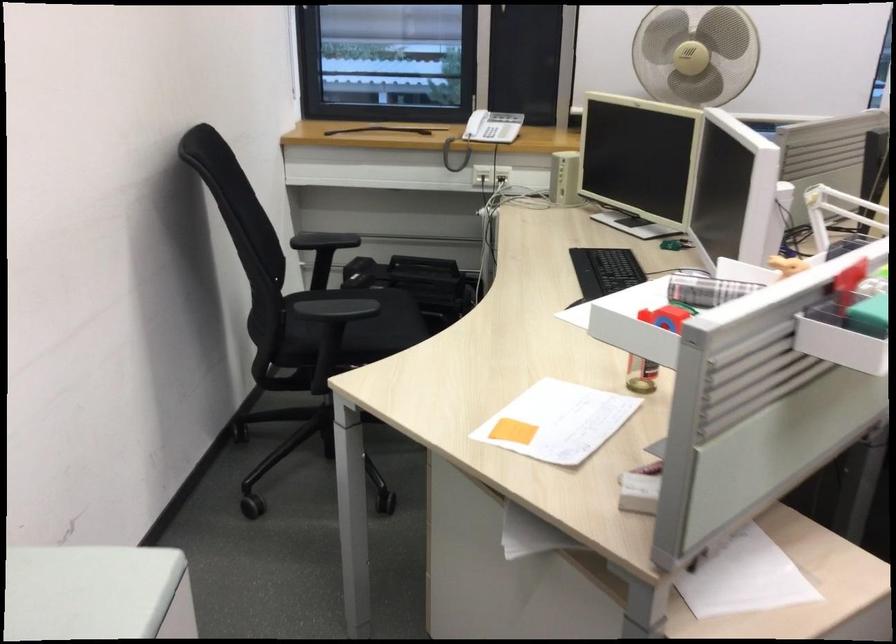
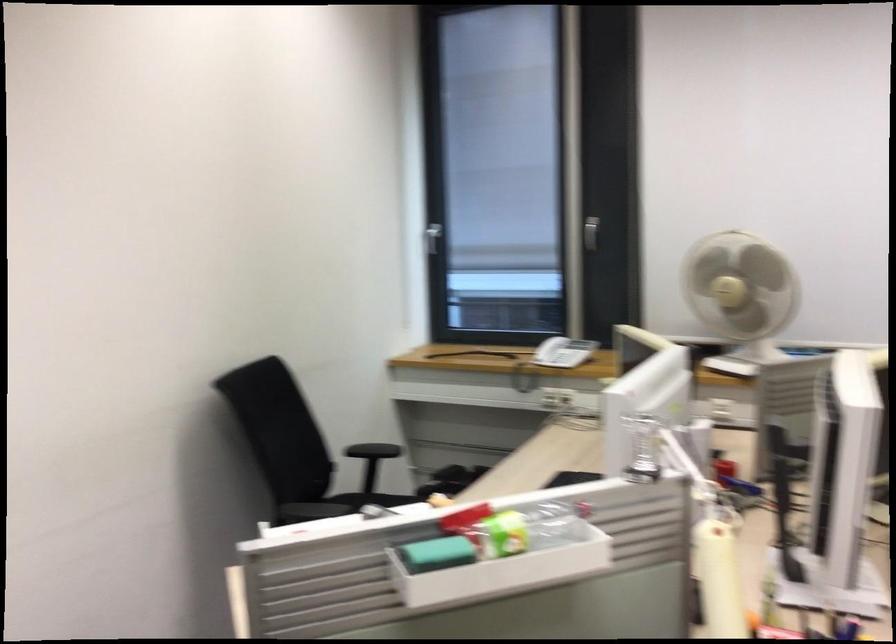
Where in the second image is the point corresponding to (x=496, y=131) from the first image?

(563, 352)